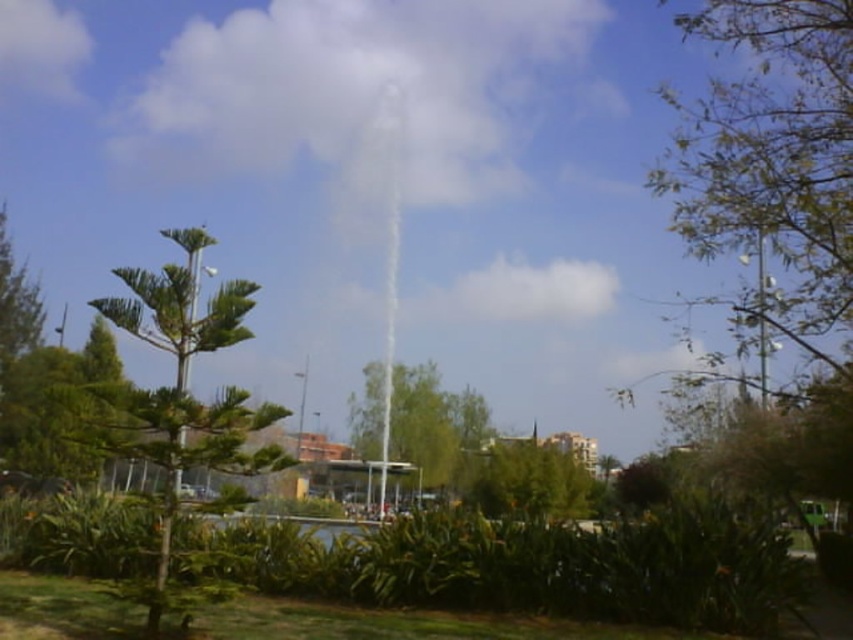
Based on the photo, who is positioned more to the left, green leafy tree at right or green leafy tree at left?

Positioned to the left is green leafy tree at left.

Does green leafy tree at right have a greater height compared to green leafy tree at left?

No, green leafy tree at right is not taller than green leafy tree at left.

At what (x,y) coordinates should I click in order to perform the action: click on green leafy tree at right. Please return your answer as a coordinate pair (x, y). Looking at the image, I should click on click(x=775, y=176).

Where is `green leafy tree at right`? The height and width of the screenshot is (640, 853). green leafy tree at right is located at coordinates (775, 176).

Can you confirm if green leafy tree at left is thinner than green leafy tree at center?

In fact, green leafy tree at left might be wider than green leafy tree at center.

Is point (241, 332) farther from camera compared to point (408, 422)?

No.

You are a GUI agent. You are given a task and a screenshot of the screen. Output one action in this format:
    pyautogui.click(x=<x>, y=<y>)
    Task: Click on the green leafy tree at left
    The width and height of the screenshot is (853, 640).
    Given the screenshot: What is the action you would take?
    pyautogui.click(x=183, y=388)

In the scene shown: Which is above, green leafy tree at right or green leafy tree at center?

green leafy tree at right is higher up.

The width and height of the screenshot is (853, 640). What do you see at coordinates (775, 176) in the screenshot? I see `green leafy tree at right` at bounding box center [775, 176].

Is point (763, 58) behind point (438, 410)?

No, (763, 58) is closer to viewer.

I want to click on green leafy tree at right, so click(775, 176).